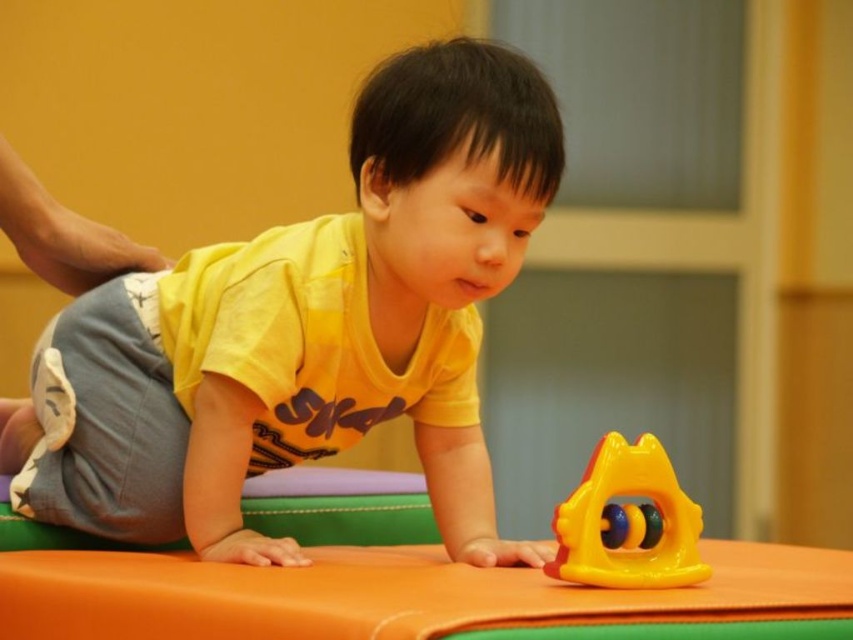
Can you confirm if yellow matte shirt at center is positioned to the right of rubberized yellow and orange toy at center?

Incorrect, yellow matte shirt at center is not on the right side of rubberized yellow and orange toy at center.

Does yellow matte shirt at center appear under rubberized yellow and orange toy at center?

Actually, yellow matte shirt at center is above rubberized yellow and orange toy at center.

Image resolution: width=853 pixels, height=640 pixels. I want to click on yellow matte shirt at center, so click(306, 330).